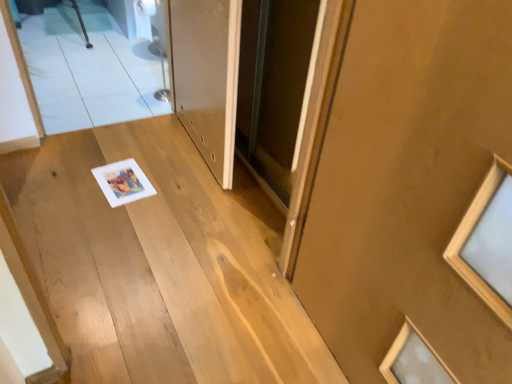
What are the coordinates of `vacant space positioned to the left of white glossy door at center, which is the 1th door from back to front` in the screenshot? It's located at (122, 158).